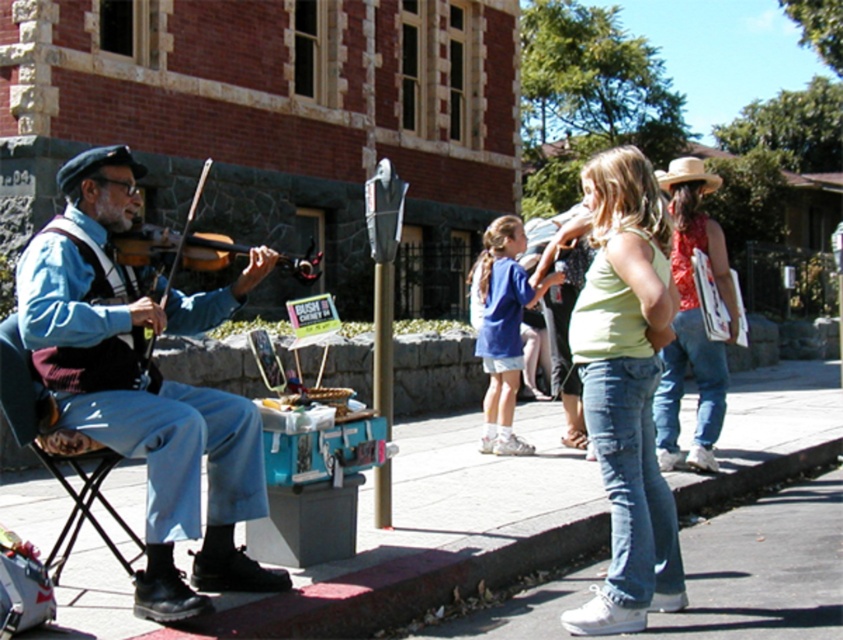
Which is in front, point (277, 614) or point (62, 538)?

Positioned in front is point (277, 614).

Is point (407, 550) behind point (36, 413)?

That is True.

Between point (294, 614) and point (63, 456), which one is positioned in front?

Point (294, 614)

You are a GUI agent. You are given a task and a screenshot of the screen. Output one action in this format:
    pyautogui.click(x=<x>, y=<y>)
    Task: Click on the smooth concrete sidewalk at center
    This screenshot has width=843, height=640.
    Given the screenshot: What is the action you would take?
    pyautogui.click(x=439, y=531)

What do you see at coordinates (143, 385) in the screenshot?
I see `blue denim jeans at left` at bounding box center [143, 385].

Locate an element on the screen. blue denim jeans at left is located at coordinates (143, 385).

Between point (744, 452) and point (664, 179), which one is positioned behind?

Point (744, 452)

Image resolution: width=843 pixels, height=640 pixels. In order to click on smooth concrete sidewalk at center in this screenshot , I will do `click(439, 531)`.